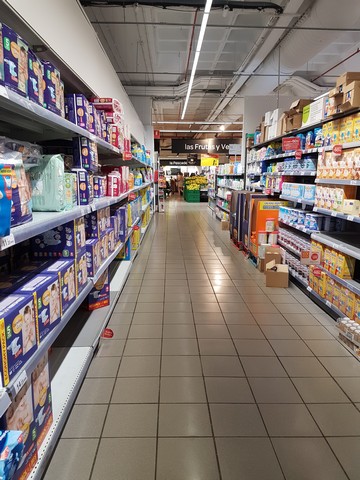
Identify the location of 1 entrance to aisle. This screenshot has width=360, height=480. (183, 201).